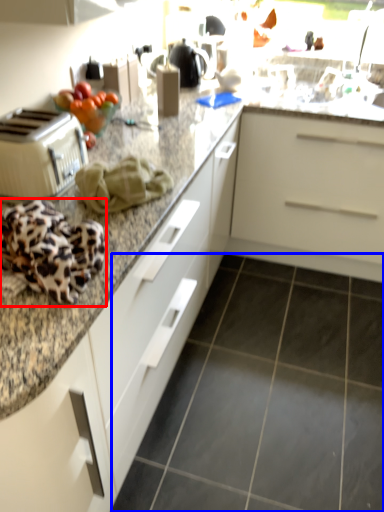
Question: Which point is closer to the camera, blanket (highlighted by a red box) or granite (highlighted by a blue box)?

Choices:
 (A) blanket
 (B) granite

Answer: (A)